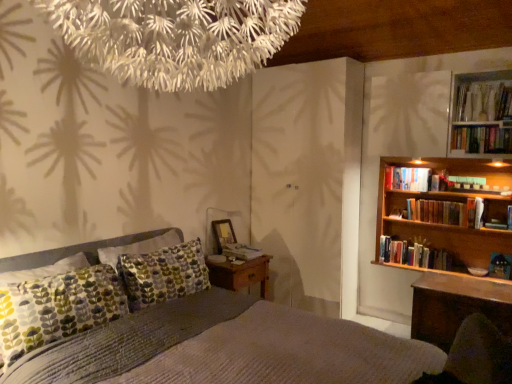
Question: Is textured gray bed at center wider or thinner than wooden bookshelf at right, which is the 6th book in top-to-bottom order?

Choices:
 (A) wide
 (B) thin

Answer: (A)

Question: From the image's perspective, is textured gray bed at center located above or below wooden bookshelf at right, marked as the fourth book in a right-to-left arrangement?

Choices:
 (A) above
 (B) below

Answer: (B)

Question: Which object is the closest to the wooden bookshelf at right?

Choices:
 (A) hardcover books at upper right, acting as the sixth book starting from the bottom
 (B) wooden bookshelf at right, the 1th book from the bottom
 (C) textured gray bed at center
 (D) hardcover book at upper right, which ranks as the fourth book in bottom-to-top order
 (E) hardcover book at bedside, which is the fifth book in top-to-bottom order

Answer: (B)

Question: Which of these objects is positioned farthest from the textured gray bed at center?

Choices:
 (A) wooden picture frame at center
 (B) hardcover books at right, positioned as the 4th book in top-to-bottom order
 (C) hardcover books at upper right, marked as the 6th book in a left-to-right arrangement
 (D) wooden table at right
 (E) wooden bookshelf at right

Answer: (C)